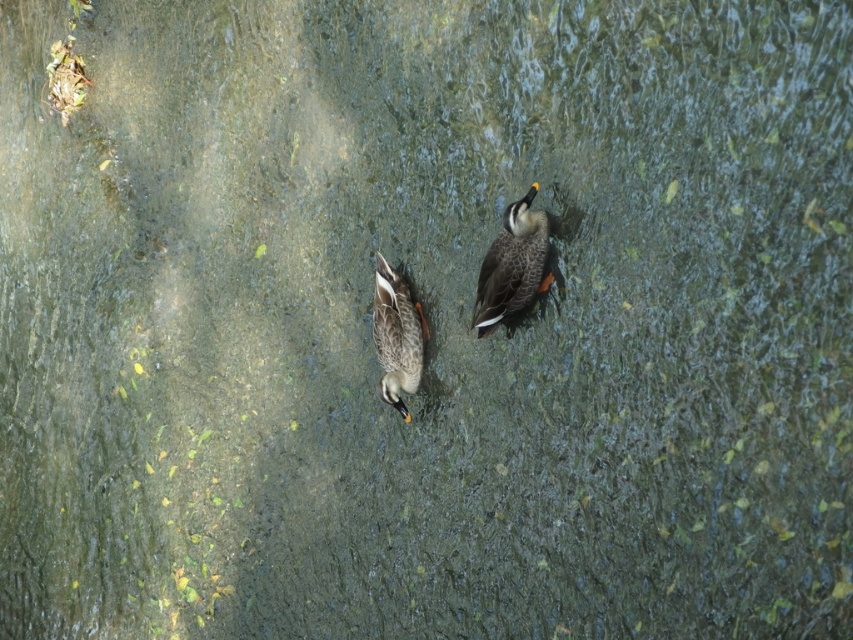
Question: Among these points, which one is nearest to the camera?

Choices:
 (A) (392, 268)
 (B) (515, 272)

Answer: (B)

Question: Does speckled brown duck at upper right appear on the right side of speckled brown duck at center?

Choices:
 (A) yes
 (B) no

Answer: (A)

Question: Where is speckled brown duck at upper right located in relation to speckled brown duck at center in the image?

Choices:
 (A) left
 (B) right

Answer: (B)

Question: Which object is farther from the camera taking this photo?

Choices:
 (A) speckled brown duck at upper right
 (B) speckled brown duck at center

Answer: (B)

Question: Is speckled brown duck at upper right below speckled brown duck at center?

Choices:
 (A) yes
 (B) no

Answer: (B)